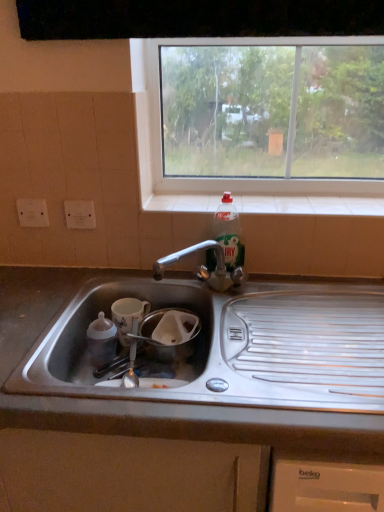
The height and width of the screenshot is (512, 384). In order to click on vacant space situated above white tile at upper center (from a real-world perspective) in this screenshot , I will do `click(298, 204)`.